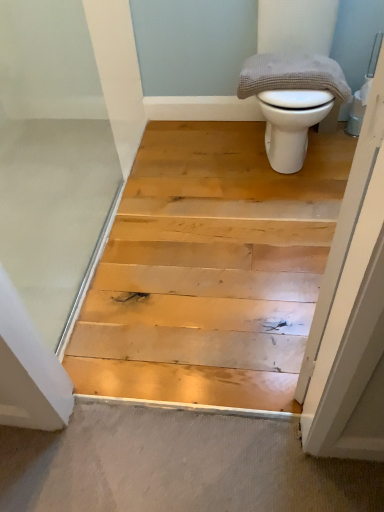
Question: From the image's perspective, is gray textured towel at upper right positioned above or below white glossy toilet at upper right?

Choices:
 (A) above
 (B) below

Answer: (B)

Question: Based on their positions, is gray textured towel at upper right located to the left or right of white glossy toilet at upper right?

Choices:
 (A) right
 (B) left

Answer: (B)

Question: Considering the positions of gray textured towel at upper right and white glossy toilet at upper right in the image, is gray textured towel at upper right wider or thinner than white glossy toilet at upper right?

Choices:
 (A) thin
 (B) wide

Answer: (A)

Question: In terms of size, does white glossy toilet at upper right appear bigger or smaller than gray textured towel at upper right?

Choices:
 (A) small
 (B) big

Answer: (B)

Question: Is point (269, 122) positioned closer to the camera than point (322, 58)?

Choices:
 (A) farther
 (B) closer

Answer: (A)

Question: From the image's perspective, is white glossy toilet at upper right above or below gray textured towel at upper right?

Choices:
 (A) below
 (B) above

Answer: (B)

Question: From a real-world perspective, is white glossy toilet at upper right positioned above or below gray textured towel at upper right?

Choices:
 (A) below
 (B) above

Answer: (A)